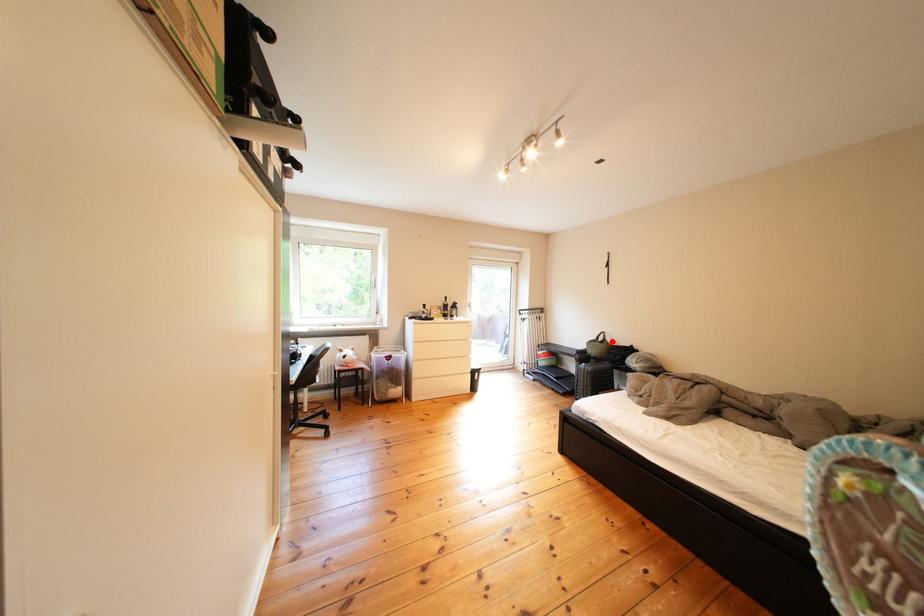
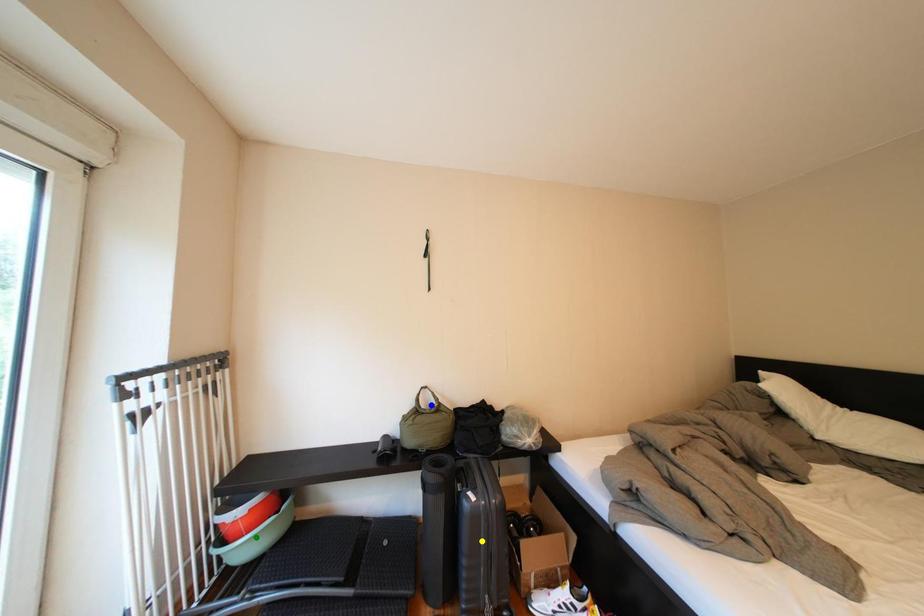
Question: I am providing you with two images of the same scene from different viewpoints. A red point is marked on the first image. You are given multiple points on the second image. Which point in image 2 is actually the same real-world point as the red point in image 1?

Choices:
 (A) yellow point
 (B) green point
 (C) blue point

Answer: (C)